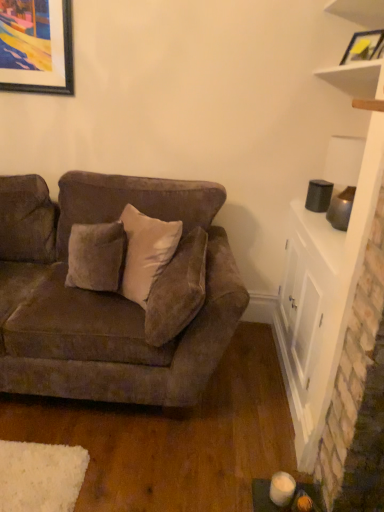
Question: Can you confirm if white matte shelf at upper right is smaller than white glossy cabinet at right?

Choices:
 (A) yes
 (B) no

Answer: (A)

Question: Is white matte shelf at upper right facing towards white glossy cabinet at right?

Choices:
 (A) no
 (B) yes

Answer: (A)

Question: From a real-world perspective, is white matte shelf at upper right physically below white glossy cabinet at right?

Choices:
 (A) no
 (B) yes

Answer: (A)

Question: Is white matte shelf at upper right not inside white glossy cabinet at right?

Choices:
 (A) no
 (B) yes

Answer: (B)

Question: Considering the relative sizes of white matte shelf at upper right and white glossy cabinet at right in the image provided, is white matte shelf at upper right wider than white glossy cabinet at right?

Choices:
 (A) no
 (B) yes

Answer: (B)

Question: Is white matte shelf at upper right positioned in front of white glossy cabinet at right?

Choices:
 (A) yes
 (B) no

Answer: (A)

Question: From a real-world perspective, does white matte shelf at upper right stand above suede-like beige pillow at center?

Choices:
 (A) no
 (B) yes

Answer: (B)

Question: Considering the relative positions of white matte shelf at upper right and suede-like beige pillow at center in the image provided, is white matte shelf at upper right behind suede-like beige pillow at center?

Choices:
 (A) no
 (B) yes

Answer: (A)

Question: Is white matte shelf at upper right looking in the opposite direction of suede-like beige pillow at center?

Choices:
 (A) yes
 (B) no

Answer: (B)

Question: Can you confirm if white matte shelf at upper right is bigger than suede-like beige pillow at center?

Choices:
 (A) yes
 (B) no

Answer: (A)

Question: Does white matte shelf at upper right have a greater width compared to suede-like beige pillow at center?

Choices:
 (A) no
 (B) yes

Answer: (B)

Question: Does white matte shelf at upper right lie in front of suede-like beige pillow at center?

Choices:
 (A) no
 (B) yes

Answer: (B)

Question: Considering the relative sizes of matte yellow picture frame at upper right and white glossy cabinet at right in the image provided, is matte yellow picture frame at upper right wider than white glossy cabinet at right?

Choices:
 (A) no
 (B) yes

Answer: (A)